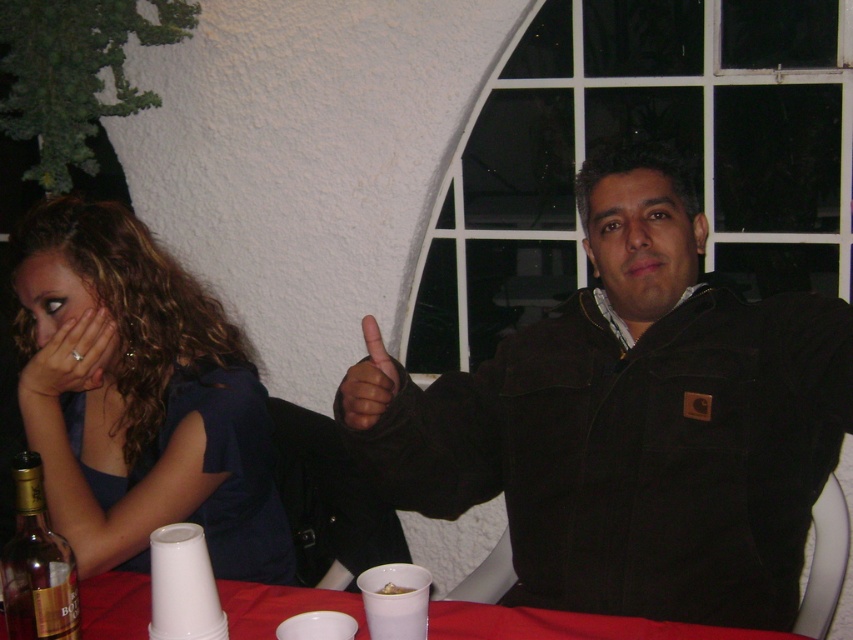
You are a bartender preparing to stack the smooth plastic cups at lower center onto the matte black hand at lower left. Considering the size of the hand and the cups, will the cups fit comfortably on the hand without spilling?

The smooth plastic cups at lower center are wider than the matte black hand at lower left, so stacking them might not fit comfortably, increasing the risk of spilling.

You are a delivery person who needs to place a small package on the table in the image. The table has a red cloth. Where should you place the package so it doesn not cover the smooth plastic cups at lower center?

Place the package away from the coordinates point (x=567, y=625) where the smooth plastic cups at lower center are located to avoid covering them.

You are a waiter at a restaurant and need to retrieve the gold foil bottle at lower left from under the black corduroy jacket at center. Can you easily access it without moving the jacket?

The black corduroy jacket at center is positioned over the gold foil bottle at lower left, so you cannot easily access the gold foil bottle at lower left without moving the jacket.